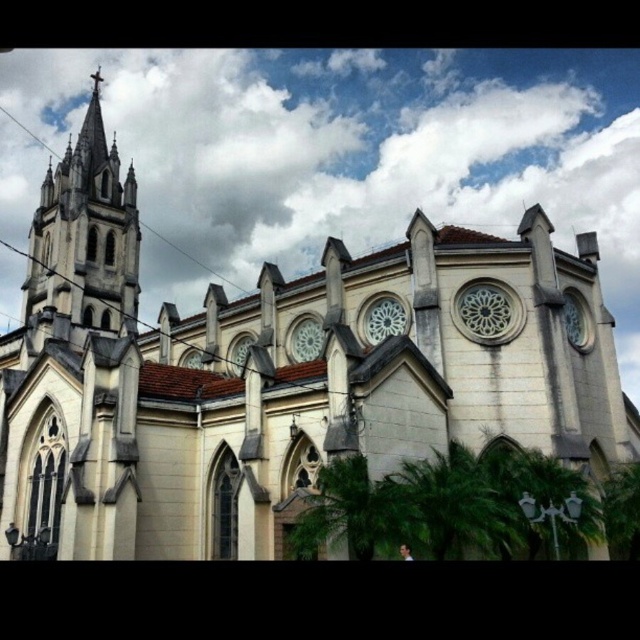
Question: Which point is farther to the camera?

Choices:
 (A) (422, 513)
 (B) (352, 508)
 (C) (99, 97)
 (D) (529, 504)

Answer: (C)

Question: Estimate the real-world distances between objects in this image. Which object is closer to the white stone tower at upper left?

Choices:
 (A) green leafy palm at lower center
 (B) green leafy palm tree at lower center
 (C) green leafy palm at lower right

Answer: (B)

Question: Does white stone tower at upper left appear on the left side of green leafy palm at lower center?

Choices:
 (A) no
 (B) yes

Answer: (B)

Question: Is white stone tower at upper left to the left of green leafy palm tree at lower center from the viewer's perspective?

Choices:
 (A) yes
 (B) no

Answer: (A)

Question: Estimate the real-world distances between objects in this image. Which object is farther from the green leafy palm tree at lower center?

Choices:
 (A) green leafy palm at lower right
 (B) green leafy palm at lower center

Answer: (A)

Question: Does green leafy palm at lower center have a larger size compared to green leafy palm tree at lower center?

Choices:
 (A) yes
 (B) no

Answer: (A)